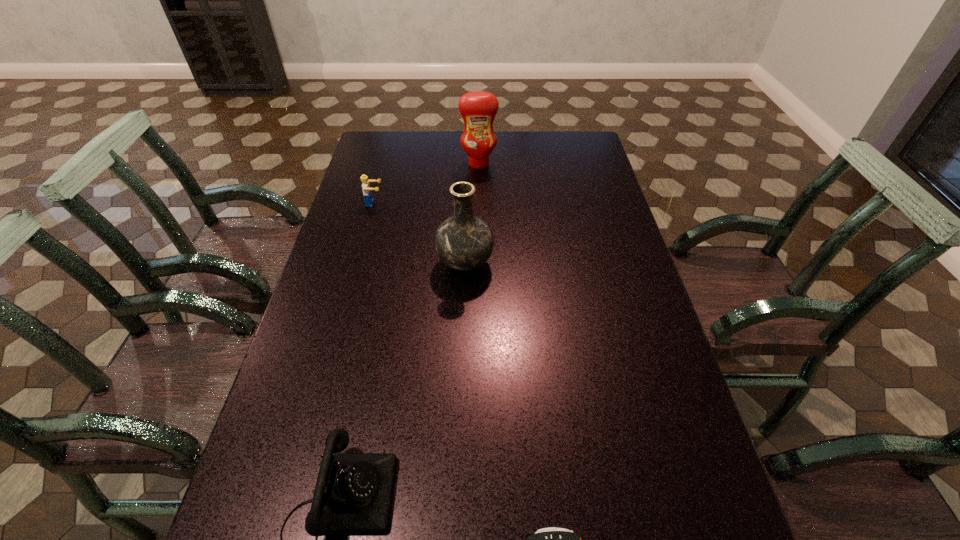
Image resolution: width=960 pixels, height=540 pixels. What are the coordinates of `condiment` in the screenshot? It's located at (478, 109).

The width and height of the screenshot is (960, 540). Identify the location of vase. [463, 242].

The height and width of the screenshot is (540, 960). Identify the location of the fourth nearest object. (366, 188).

Locate an element on the screen. Image resolution: width=960 pixels, height=540 pixels. vacant space situated 0.210m on the label side of the farthest object is located at coordinates (479, 204).

At what (x,y) coordinates should I click in order to perform the action: click on free location located 0.140m on the left of the vase. Please return your answer as a coordinate pair (x, y). Looking at the image, I should click on (388, 264).

Where is `free space located 0.180m on the face of the fourth nearest object`? free space located 0.180m on the face of the fourth nearest object is located at coordinates (437, 203).

Where is `object located at the far edge`? This screenshot has height=540, width=960. object located at the far edge is located at coordinates (478, 109).

Locate an element on the screen. Image resolution: width=960 pixels, height=540 pixels. object that is at the left edge is located at coordinates (366, 188).

At what (x,y) coordinates should I click in order to perform the action: click on free space at the far edge of the desktop. Please return your answer as a coordinate pair (x, y). Looking at the image, I should click on (424, 158).

At what (x,y) coordinates should I click in order to perform the action: click on vacant area at the left edge of the desktop. Please return your answer as a coordinate pair (x, y). Looking at the image, I should click on (289, 482).